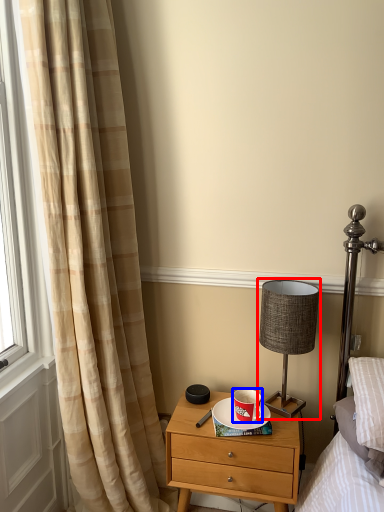
Question: Which point is closer to the camera, table lamp (highlighted by a red box) or coffee cup (highlighted by a blue box)?

Choices:
 (A) table lamp
 (B) coffee cup

Answer: (A)